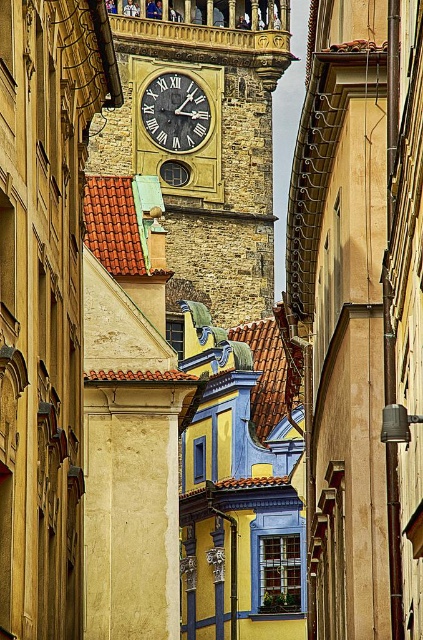
What are the coordinates of `stone clock tower at center` in the screenshot? It's located at pos(202,136).

Can you confirm if stone clock tower at center is positioned to the right of gold/yellow metal clock at center?

Correct, you'll find stone clock tower at center to the right of gold/yellow metal clock at center.

Is point (183, 144) positioned behind point (164, 84)?

No, it is in front of (164, 84).

Where is `stone clock tower at center`? stone clock tower at center is located at coordinates (202, 136).